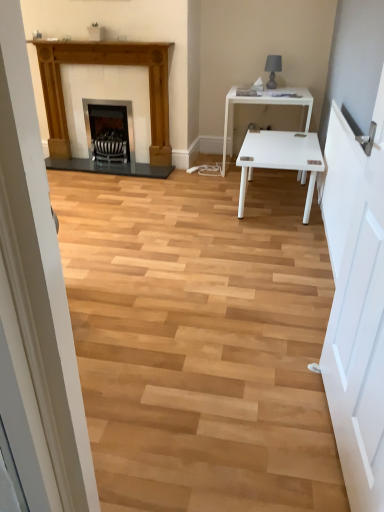
Find the location of a particular element. free space to the left of white wooden door at right is located at coordinates (235, 431).